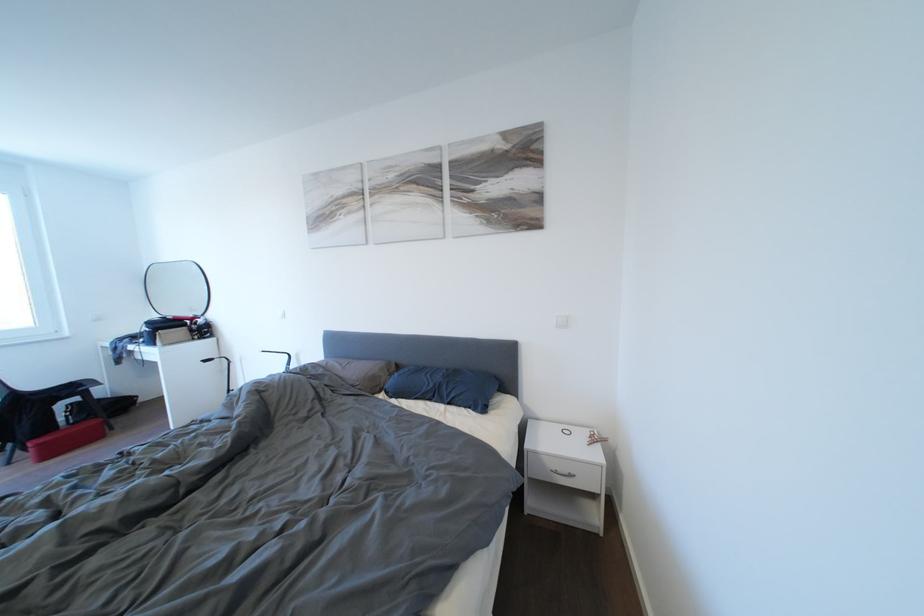
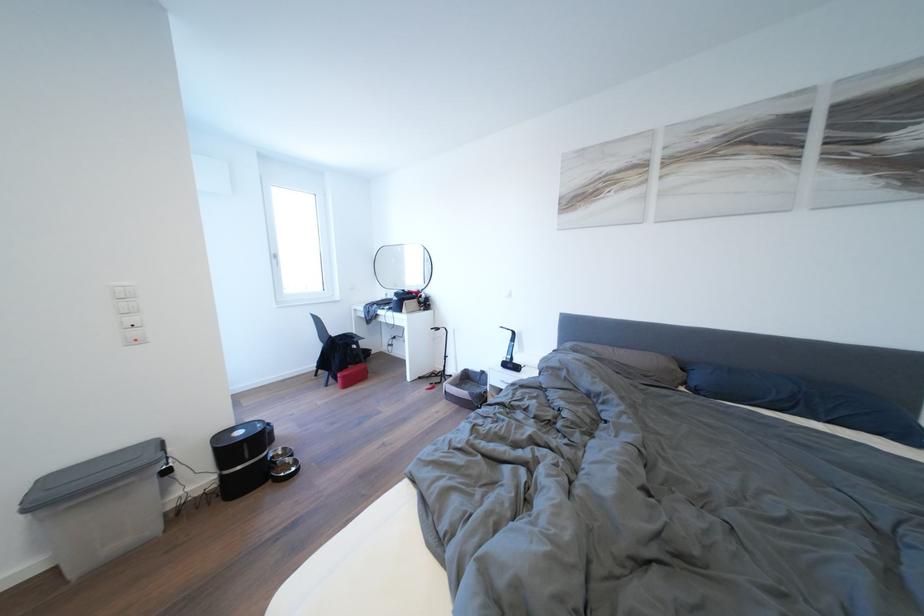
Where in the second image is the point corresponding to point (395, 398) from the first image?

(703, 395)